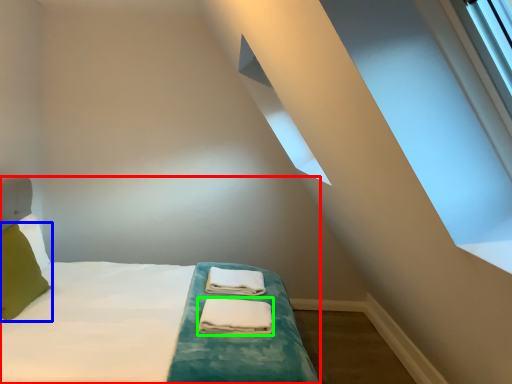
Question: Considering the real-world distances, which object is farthest from bed (highlighted by a red box)? pillow (highlighted by a blue box) or material (highlighted by a green box)?

Choices:
 (A) pillow
 (B) material

Answer: (A)